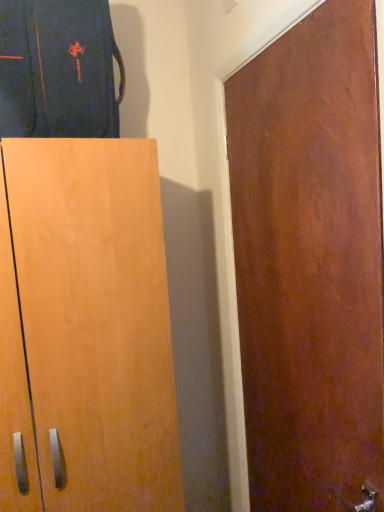
Question: Should I look upward or downward to see dark blue fabric jacket at upper left?

Choices:
 (A) up
 (B) down

Answer: (A)